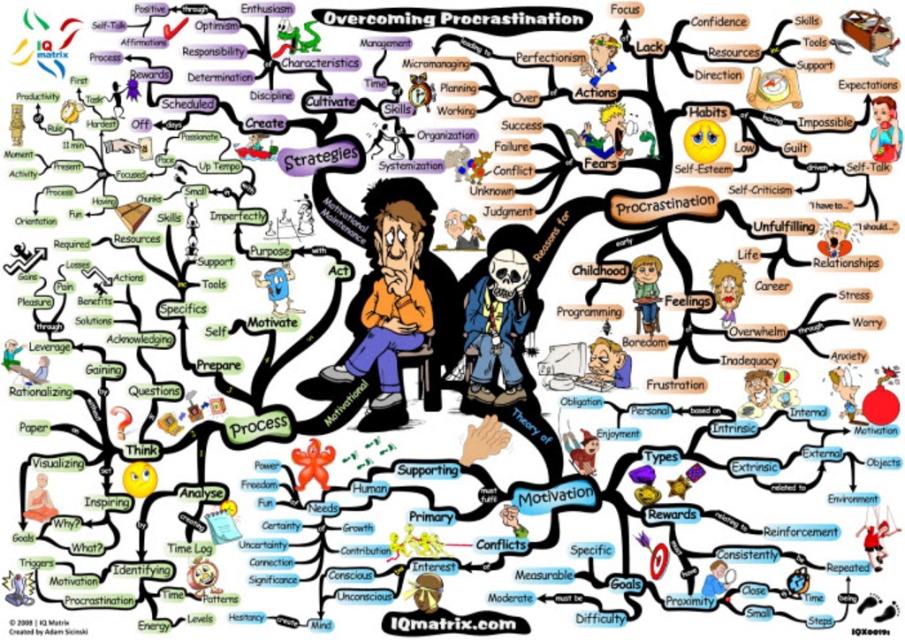
Does point (412, 308) come behind point (900, 134)?

Yes, point (412, 308) is behind point (900, 134).

Can you confirm if orange shirt at center is positioned to the left of smooth fabric shirt at upper right?

Correct, you'll find orange shirt at center to the left of smooth fabric shirt at upper right.

Does point (380, 406) come farther from viewer compared to point (882, 160)?

That is True.

This screenshot has height=640, width=905. I want to click on orange shirt at center, so click(x=395, y=298).

Who is higher up, cartoon woman at center or matte orange monk at lower left?

cartoon woman at center is higher up.

Between cartoon woman at center and matte orange monk at lower left, which one has less height?

Standing shorter between the two is matte orange monk at lower left.

The width and height of the screenshot is (905, 640). Find the location of `cartoon woman at center`. cartoon woman at center is located at coordinates (726, 288).

In order to click on cartoon woman at center in this screenshot , I will do `click(726, 288)`.

Can you confirm if wooden chair at center is bigger than cartoon woman at center?

Yes.

Consider the image. Who is taller, wooden chair at center or cartoon woman at center?

Standing taller between the two is wooden chair at center.

You are a GUI agent. You are given a task and a screenshot of the screen. Output one action in this format:
    pyautogui.click(x=<x>, y=<y>)
    Task: Click on the wooden chair at center
    Image resolution: width=905 pixels, height=640 pixels.
    Given the screenshot: What is the action you would take?
    pyautogui.click(x=646, y=291)

The image size is (905, 640). What are the coordinates of `wooden chair at center` in the screenshot? It's located at (646, 291).